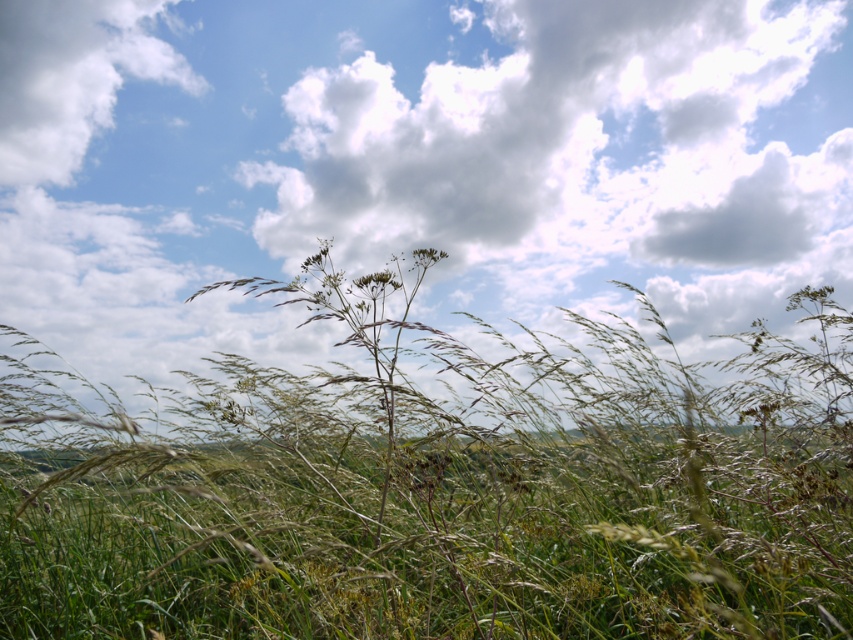
In the scene shown: Who is more forward, (242, 522) or (132, 60)?

Point (242, 522)

Which is behind, point (36, 522) or point (99, 49)?

The point (99, 49) is behind.

Is point (144, 461) positioned after point (57, 36)?

No, it is in front of (57, 36).

You are a GUI agent. You are given a task and a screenshot of the screen. Output one action in this format:
    pyautogui.click(x=<x>, y=<y>)
    Task: Click on the green grass at center
    The width and height of the screenshot is (853, 640).
    Given the screenshot: What is the action you would take?
    pyautogui.click(x=434, y=484)